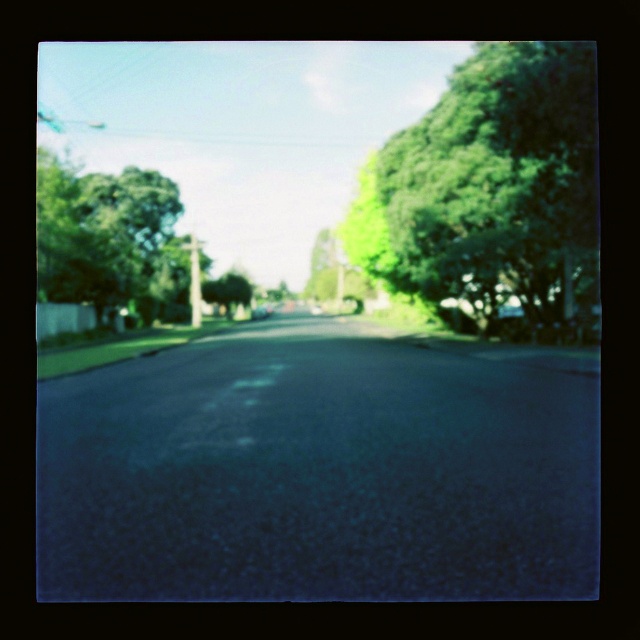
You are standing in the middle of the road and see both the green leafy tree at right and the green leafy tree at left. Which tree would you need to look up higher to see the top of?

You would need to look up higher to see the top of the green leafy tree at left because it is taller than the green leafy tree at right.

You are standing on the road in the image and want to walk towards the green leafy tree at center. Which direction should you walk to avoid the green leafy tree at right?

Since the green leafy tree at right is closer to the viewer than the green leafy tree at center, you should walk towards the left side of the road to avoid the green leafy tree at right and head towards the green leafy tree at center.

You are a photographer standing in the middle of the road. You want to take a photo of both the green leafy tree at right and the green leafy tree at left. Which tree should you zoom in on to capture more details of its leaves?

The green leafy tree at right has a larger size compared to the green leafy tree at left, so zooming in on the green leafy tree at right will allow you to capture more details of its leaves.